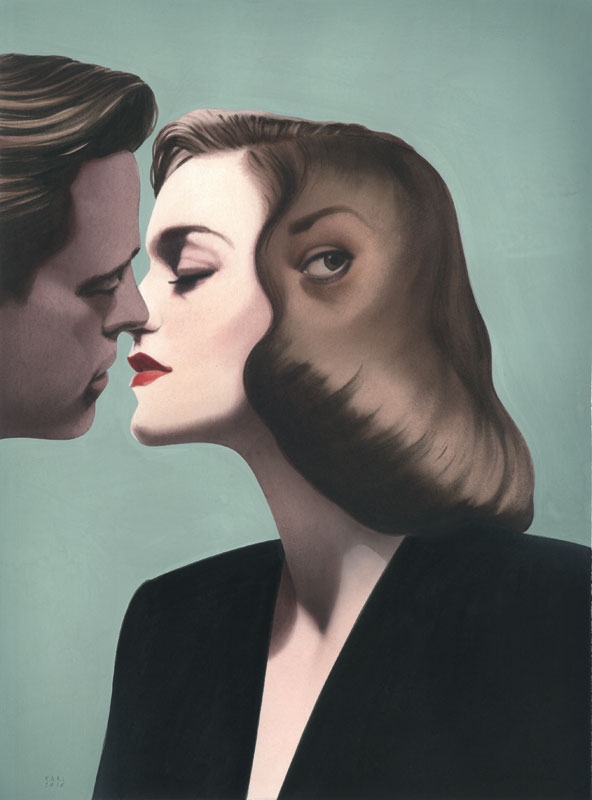
What are the coordinates of `painting` in the screenshot? It's located at (534, 280).